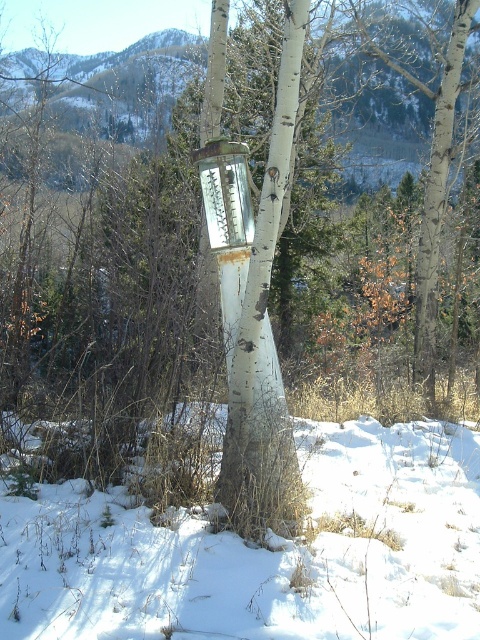
Does white powdery snow at lower center have a lesser width compared to metallic glass thermometer at center?

In fact, white powdery snow at lower center might be wider than metallic glass thermometer at center.

Is white powdery snow at lower center further to camera compared to metallic glass thermometer at center?

That is False.

Measure the distance between point (109, 596) and camera.

A distance of 11.40 feet exists between point (109, 596) and camera.

You are a GUI agent. You are given a task and a screenshot of the screen. Output one action in this format:
    pyautogui.click(x=<x>, y=<y>)
    Task: Click on the white powdery snow at lower center
    The height and width of the screenshot is (640, 480).
    Given the screenshot: What is the action you would take?
    pyautogui.click(x=263, y=552)